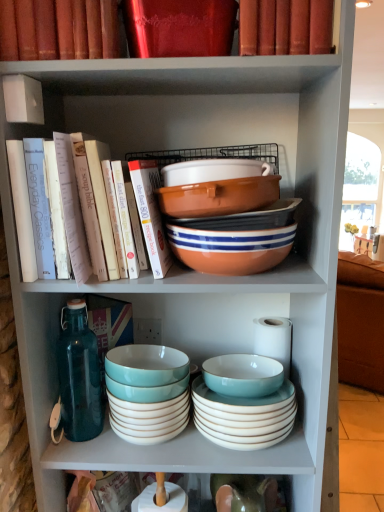
The width and height of the screenshot is (384, 512). I want to click on matte orange bowl at center, positioned as the seventh bowl in bottom-to-top order, so click(213, 170).

In order to face orange glazed bowl at center, the 4th bowl when ordered from bottom to top, should I rotate leftwards or rightwards?

Rotate your view right by about 5.879°.

Identify the location of shiny red book at upper center, which appears as the second book when ordered from the bottom. (180, 27).

What do you see at coordinates (244, 417) in the screenshot?
I see `matte ceramic bowl at lower center, the 2th bowl from the bottom` at bounding box center [244, 417].

This screenshot has width=384, height=512. What do you see at coordinates (218, 197) in the screenshot?
I see `matte orange bowl at center, which ranks as the sixth bowl in bottom-to-top order` at bounding box center [218, 197].

In order to face teal ceramic bowls at center, acting as the 7th bowl starting from the top, should I rotate leftwards or rightwards?

Rotate left and turn 5.785 degrees.

This screenshot has height=512, width=384. Find the location of `matte orange bowl at center, positioned as the seventh bowl in bottom-to-top order`. matte orange bowl at center, positioned as the seventh bowl in bottom-to-top order is located at coordinates (213, 170).

Based on the photo, from a real-world perspective, which is physically below, hardcover books at left, positioned as the 4th book in top-to-bottom order, or matte orange bowl at center, which ranks as the sixth bowl in bottom-to-top order?

From a 3D spatial view, hardcover books at left, positioned as the 4th book in top-to-bottom order, is below.

Which is in front, point (126, 236) or point (179, 215)?

Positioned in front is point (179, 215).

Is hardcover books at left, which is counted as the first book, starting from the bottom, facing towards matte orange bowl at center, which ranks as the sixth bowl in bottom-to-top order?

No, hardcover books at left, which is counted as the first book, starting from the bottom, does not turn towards matte orange bowl at center, which ranks as the sixth bowl in bottom-to-top order.

Is matte ceramic bowl at center, the third bowl viewed from the top, surrounded by teal ceramic bowls at center, acting as the 7th bowl starting from the top?

No, matte ceramic bowl at center, the third bowl viewed from the top, is not inside teal ceramic bowls at center, acting as the 7th bowl starting from the top.

Does teal ceramic bowls at center, acting as the 7th bowl starting from the top, appear on the left side of matte ceramic bowl at center, the third bowl viewed from the top?

Yes.

How distant is teal ceramic bowls at center, acting as the 7th bowl starting from the top, from matte ceramic bowl at center, the third bowl viewed from the top?

47.49 centimeters.

Which is behind, teal ceramic bowls at center, acting as the 7th bowl starting from the top, or matte ceramic bowl at center, the third bowl viewed from the top?

teal ceramic bowls at center, acting as the 7th bowl starting from the top, is further away from the camera.

Which object is further away from the camera taking this photo, teal ceramic bowls at center, the 1th bowl from the bottom, or shiny red book at upper center, acting as the 3th book starting from the top?

Positioned behind is teal ceramic bowls at center, the 1th bowl from the bottom.

How many degrees apart are the facing directions of teal ceramic bowls at center, acting as the 7th bowl starting from the top, and shiny red book at upper center, acting as the 3th book starting from the top?

The angle between the facing direction of teal ceramic bowls at center, acting as the 7th bowl starting from the top, and the facing direction of shiny red book at upper center, acting as the 3th book starting from the top, is 0.0448 degrees.

Image resolution: width=384 pixels, height=512 pixels. Identify the location of bowl lying on the left of shiny red book at upper center, which appears as the second book when ordered from the bottom. (149, 419).

Between matte red book at upper center, the 3th book from the bottom, and matte ceramic bowl at lower center, which ranks as the sixth bowl in top-to-bottom order, which one is positioned behind?

matte ceramic bowl at lower center, which ranks as the sixth bowl in top-to-bottom order, is further from the camera.

Is matte red book at upper center, the 3th book from the bottom, far from matte ceramic bowl at lower center, the 2th bowl from the bottom?

That's not correct — matte red book at upper center, the 3th book from the bottom, is a little close to matte ceramic bowl at lower center, the 2th bowl from the bottom.

Which bowl is the 5th one when counting from the back of the matte red book at upper center, the 3th book from the bottom? Please provide its 2D coordinates.

[(244, 417)]

From a real-world perspective, who is located higher, matte red book at upper center, placed as the second book when sorted from top to bottom, or matte ceramic bowl at lower center, which ranks as the sixth bowl in top-to-bottom order?

matte red book at upper center, placed as the second book when sorted from top to bottom, from a real-world perspective.

From a real-world perspective, who is located lower, matte red book at upper center, placed as the second book when sorted from top to bottom, or matte orange bowl at center, the second bowl viewed from the top?

matte orange bowl at center, the second bowl viewed from the top, is physically lower.

How much distance is there between matte red book at upper center, the 3th book from the bottom, and matte orange bowl at center, which ranks as the sixth bowl in bottom-to-top order?

10.76 inches.

Considering the sizes of objects matte red book at upper center, placed as the second book when sorted from top to bottom, and matte orange bowl at center, the second bowl viewed from the top, in the image provided, who is thinner, matte red book at upper center, placed as the second book when sorted from top to bottom, or matte orange bowl at center, the second bowl viewed from the top,?

With smaller width is matte orange bowl at center, the second bowl viewed from the top.

Looking at this image, considering the relative sizes of matte red book at upper center, the 3th book from the bottom, and matte orange bowl at center, which ranks as the sixth bowl in bottom-to-top order, in the image provided, is matte red book at upper center, the 3th book from the bottom, shorter than matte orange bowl at center, which ranks as the sixth bowl in bottom-to-top order,?

In fact, matte red book at upper center, the 3th book from the bottom, may be taller than matte orange bowl at center, which ranks as the sixth bowl in bottom-to-top order.

From a real-world perspective, is matte orange bowl at center, positioned as the seventh bowl in bottom-to-top order, on matte ceramic bowl at center, the third bowl viewed from the top?

Yes.

Is matte orange bowl at center, which is counted as the first bowl, starting from the top, completely or partially outside of matte ceramic bowl at center, the fifth bowl positioned from the bottom?

That's correct, matte orange bowl at center, which is counted as the first bowl, starting from the top, is outside of matte ceramic bowl at center, the fifth bowl positioned from the bottom.

Is point (230, 162) closer or farther from the camera than point (231, 225)?

Point (230, 162) appears to be closer to the viewer than point (231, 225).

Find the location of a particular element. This screenshot has width=384, height=512. book that is the 1st one above the orange glazed bowl at center, the 4th bowl when ordered from bottom to top (from a real-world perspective) is located at coordinates (106, 210).

In terms of height, does orange glazed bowl at center, which is the 4th bowl in top-to-bottom order, look taller or shorter compared to hardcover books at left, which is counted as the first book, starting from the bottom?

Considering their sizes, orange glazed bowl at center, which is the 4th bowl in top-to-bottom order, has less height than hardcover books at left, which is counted as the first book, starting from the bottom.

Considering the relative positions of orange glazed bowl at center, which is the 4th bowl in top-to-bottom order, and hardcover books at left, which is counted as the first book, starting from the bottom, in the image provided, is orange glazed bowl at center, which is the 4th bowl in top-to-bottom order, to the right of hardcover books at left, which is counted as the first book, starting from the bottom, from the viewer's perspective?

Yes.

Is point (235, 231) positioned before point (97, 244)?

No, (235, 231) is behind (97, 244).

From the image's perspective, count 1st bowls upward from the hardcover books at left, positioned as the 4th book in top-to-bottom order, and point to it. Please provide its 2D coordinates.

[(218, 197)]

In order to click on the 4th bowl below the matte ceramic bowl at center, the third bowl viewed from the top (from the image's perspective) in this screenshot , I will do `click(149, 419)`.

Based on their spatial positions, is orange glazed bowl at center, which is the 4th bowl in top-to-bottom order, or hardcover books at left, which is counted as the first book, starting from the bottom, further from matte ceramic bowl at lower center, which ranks as the sixth bowl in top-to-bottom order?

hardcover books at left, which is counted as the first book, starting from the bottom.

Looking at the image, which one is located closer to hardcover books at left, positioned as the 4th book in top-to-bottom order, matte red book at upper center, the 3th book from the bottom, or matte red book at upper center, marked as the fourth book in a bottom-to-top arrangement?

matte red book at upper center, marked as the fourth book in a bottom-to-top arrangement.

Considering their positions, is matte red book at upper center, marked as the fourth book in a bottom-to-top arrangement, positioned closer to orange glazed bowl at center, the 4th bowl when ordered from bottom to top, than hardcover books at left, which is counted as the first book, starting from the bottom?

hardcover books at left, which is counted as the first book, starting from the bottom, is positioned closer to the anchor orange glazed bowl at center, the 4th bowl when ordered from bottom to top.

Considering their positions, is matte ceramic bowl at center, the third bowl viewed from the top, positioned closer to matte ceramic bowl at lower center, which ranks as the sixth bowl in top-to-bottom order, than hardcover books at left, positioned as the 4th book in top-to-bottom order?

matte ceramic bowl at center, the third bowl viewed from the top, is positioned closer to the anchor matte ceramic bowl at lower center, which ranks as the sixth bowl in top-to-bottom order.

Which object lies nearer to the anchor point matte red book at upper center, the 3th book from the bottom, matte red book at upper center, marked as the fourth book in a bottom-to-top arrangement, or teal ceramic bowls at center, the 1th bowl from the bottom?

matte red book at upper center, marked as the fourth book in a bottom-to-top arrangement.

When comparing their distances from matte red book at upper center, placed as the 1th book when sorted from top to bottom, does matte ceramic bowl at lower center, which ranks as the sixth bowl in top-to-bottom order, or teal glossy bowl at center, the 5th bowl positioned from the top, seem further?

matte ceramic bowl at lower center, which ranks as the sixth bowl in top-to-bottom order, is further to matte red book at upper center, placed as the 1th book when sorted from top to bottom.

Considering their positions, is teal ceramic bowls at center, the 1th bowl from the bottom, positioned further to hardcover books at left, positioned as the 4th book in top-to-bottom order, than matte red book at upper center, marked as the fourth book in a bottom-to-top arrangement?

Based on the image, teal ceramic bowls at center, the 1th bowl from the bottom, appears to be further to hardcover books at left, positioned as the 4th book in top-to-bottom order.

From the picture: Which object lies further to the anchor point orange glazed bowl at center, the 4th bowl when ordered from bottom to top, shiny red book at upper center, acting as the 3th book starting from the top, or matte orange bowl at center, positioned as the seventh bowl in bottom-to-top order?

shiny red book at upper center, acting as the 3th book starting from the top.

Find the location of `book that lies between matte orange bowl at center, positioned as the seventh bowl in bottom-to-top order, and teal ceramic bowls at center, acting as the 7th bowl starting from the top, from top to bottom`. book that lies between matte orange bowl at center, positioned as the seventh bowl in bottom-to-top order, and teal ceramic bowls at center, acting as the 7th bowl starting from the top, from top to bottom is located at coordinates (106, 210).

Find the location of a particular element. book between hardcover books at left, which is counted as the first book, starting from the bottom, and matte red book at upper center, placed as the second book when sorted from top to bottom, in the horizontal direction is located at coordinates click(180, 27).

Where is `bowl that lies between matte red book at upper center, the 3th book from the bottom, and matte orange bowl at center, which ranks as the sixth bowl in bottom-to-top order, from top to bottom`? The image size is (384, 512). bowl that lies between matte red book at upper center, the 3th book from the bottom, and matte orange bowl at center, which ranks as the sixth bowl in bottom-to-top order, from top to bottom is located at coordinates (213, 170).

I want to click on book that lies between matte orange bowl at center, positioned as the seventh bowl in bottom-to-top order, and teal glossy bowl at center, the 5th bowl positioned from the top, from top to bottom, so click(106, 210).